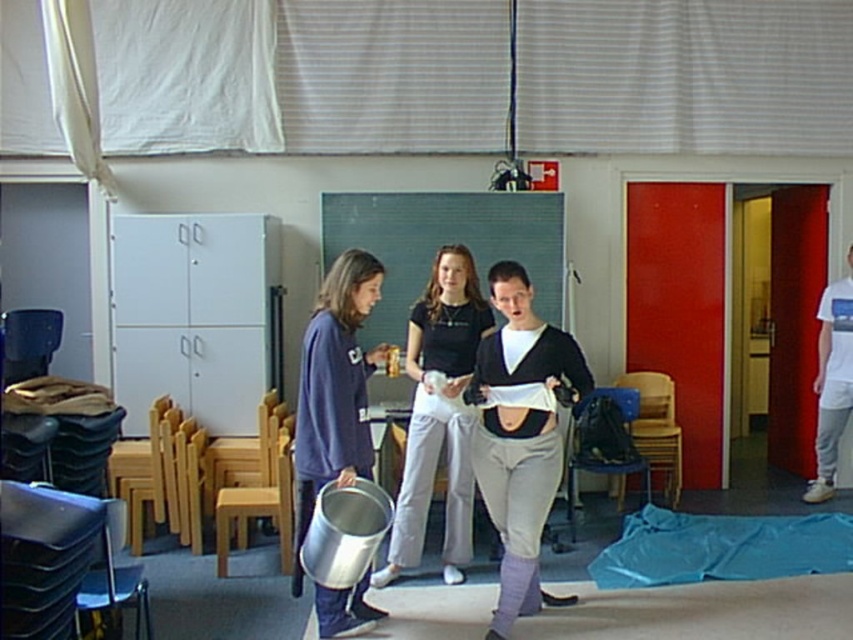
Can you confirm if matte black shirt at center is bigger than blue fabric tarp at lower right?

Yes, matte black shirt at center is bigger than blue fabric tarp at lower right.

Find the location of a particular element. matte black shirt at center is located at coordinates (439, 413).

This screenshot has width=853, height=640. What do you see at coordinates (439, 413) in the screenshot? I see `matte black shirt at center` at bounding box center [439, 413].

Where is `matte black shirt at center`? This screenshot has width=853, height=640. matte black shirt at center is located at coordinates (439, 413).

Does point (329, 464) come in front of point (790, 522)?

Yes, point (329, 464) is in front of point (790, 522).

Which of these two, matte purple sweatshirt at center or blue fabric tarp at lower right, stands taller?

Result: matte purple sweatshirt at center is taller.

Which is behind, point (299, 385) or point (842, 538)?

The point (299, 385) is behind.

Image resolution: width=853 pixels, height=640 pixels. What are the coordinates of `matte purple sweatshirt at center` in the screenshot? It's located at (335, 387).

Does point (537, 524) lie behind point (354, 412)?

No, (537, 524) is in front of (354, 412).

The width and height of the screenshot is (853, 640). What do you see at coordinates (518, 500) in the screenshot? I see `matte black sweater at center` at bounding box center [518, 500].

Which is in front, point (486, 429) or point (334, 288)?

Positioned in front is point (334, 288).

Where is `matte black sweater at center`? matte black sweater at center is located at coordinates 518,500.